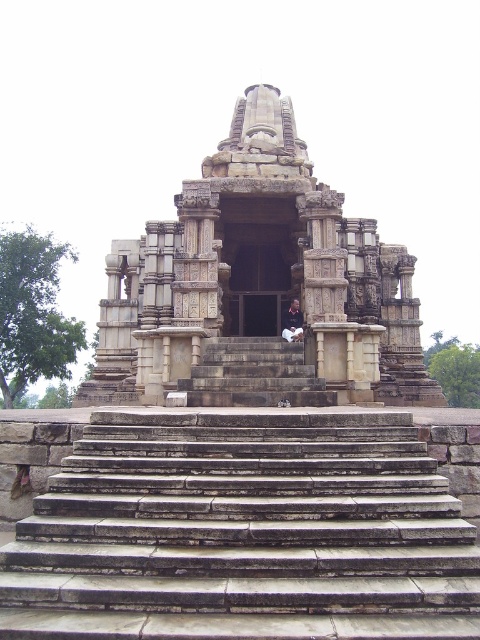
You are a tourist standing at the base of the brown stone stairs at center, looking up at the beige stone hindu temple at center. Which structure appears taller from your vantage point?

The beige stone hindu temple at center appears taller than the brown stone stairs at center because the brown stone stairs at center has a lesser height compared to the beige stone hindu temple at center.

You are standing at the base of the brown stone stairs at center and want to enter the beige stone hindu temple at center. Which direction should you walk to reach the temple entrance?

You should walk forward towards the beige stone hindu temple at center because the brown stone stairs at center are in front of it, leading directly to the temple entrance.